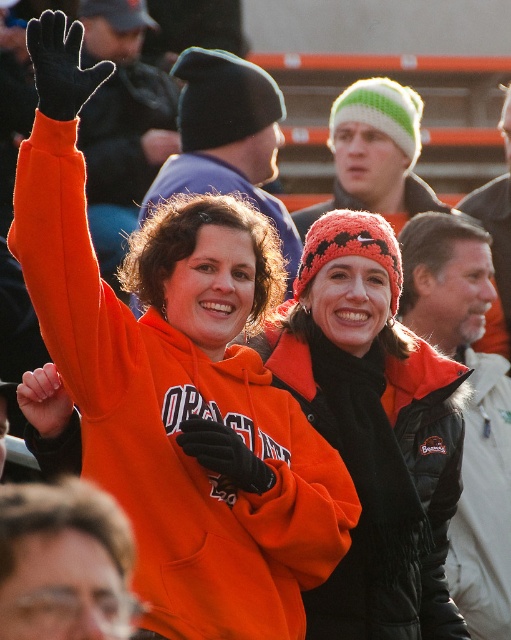
Can you confirm if orange fleece sweatshirt at upper left is positioned to the right of knitted wool beanie at center?

In fact, orange fleece sweatshirt at upper left is to the left of knitted wool beanie at center.

Who is more forward, [75,324] or [364,556]?

Point [75,324] is more forward.

The image size is (511, 640). What are the coordinates of `orange fleece sweatshirt at upper left` in the screenshot? It's located at (177, 384).